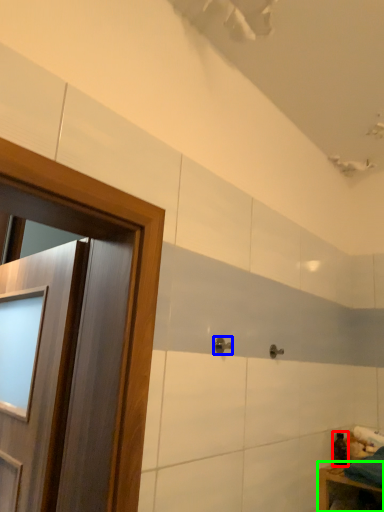
Question: Considering the real-world distances, which object is closest to toiletry (highlighted by a red box)? door handle (highlighted by a blue box) or furniture (highlighted by a green box).

Choices:
 (A) door handle
 (B) furniture

Answer: (B)